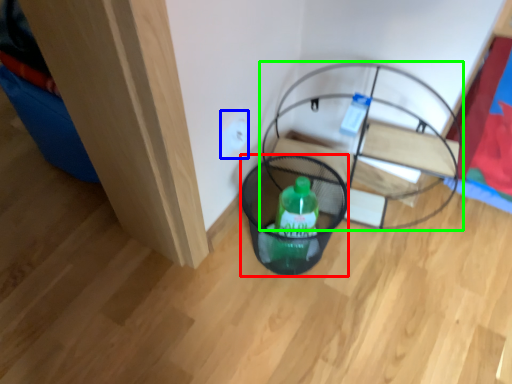
Question: Which object is positioned closest to basket (highlighted by a red box)? Select from electric outlet (highlighted by a blue box) and furniture (highlighted by a green box).

Choices:
 (A) electric outlet
 (B) furniture

Answer: (B)